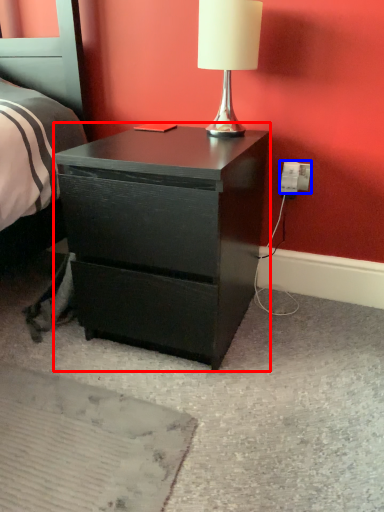
Question: Which point is further to the camera, nightstand (highlighted by a red box) or electric outlet (highlighted by a blue box)?

Choices:
 (A) nightstand
 (B) electric outlet

Answer: (B)